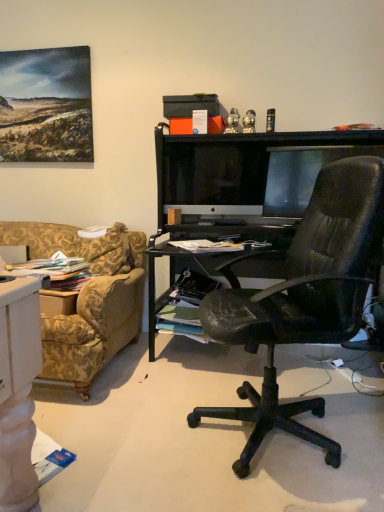
Question: From a real-world perspective, is matte black monitor at center, which is the 2th computer monitor from left to right, physically located above or below satin black monitor at center, placed as the 1th computer monitor when sorted from left to right?

Choices:
 (A) below
 (B) above

Answer: (A)

Question: In terms of width, does matte black monitor at center, which is the 2th computer monitor from left to right, look wider or thinner when compared to satin black monitor at center, acting as the 2th computer monitor starting from the right?

Choices:
 (A) wide
 (B) thin

Answer: (B)

Question: Considering the positions of matte black monitor at center, acting as the 1th computer monitor starting from the right, and satin black monitor at center, placed as the 1th computer monitor when sorted from left to right, in the image, is matte black monitor at center, acting as the 1th computer monitor starting from the right, bigger or smaller than satin black monitor at center, placed as the 1th computer monitor when sorted from left to right,?

Choices:
 (A) big
 (B) small

Answer: (B)

Question: From a real-world perspective, relative to matte black monitor at center, acting as the 1th computer monitor starting from the right, is satin black monitor at center, placed as the 1th computer monitor when sorted from left to right, vertically above or below?

Choices:
 (A) above
 (B) below

Answer: (A)

Question: Is satin black monitor at center, acting as the 2th computer monitor starting from the right, taller or shorter than matte black monitor at center, which is the 2th computer monitor from left to right?

Choices:
 (A) short
 (B) tall

Answer: (B)

Question: Considering the positions of satin black monitor at center, acting as the 2th computer monitor starting from the right, and matte black monitor at center, which is the 2th computer monitor from left to right, in the image, is satin black monitor at center, acting as the 2th computer monitor starting from the right, wider or thinner than matte black monitor at center, which is the 2th computer monitor from left to right,?

Choices:
 (A) wide
 (B) thin

Answer: (A)

Question: Is satin black monitor at center, acting as the 2th computer monitor starting from the right, inside or outside of matte black monitor at center, which is the 2th computer monitor from left to right?

Choices:
 (A) inside
 (B) outside

Answer: (B)